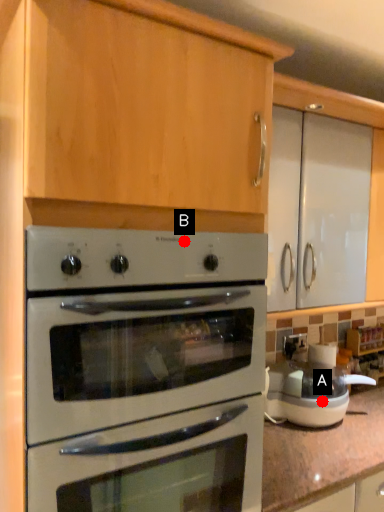
Question: Two points are circled on the image, labeled by A and B beside each circle. Which of the following is the closest to the observer?

Choices:
 (A) A is closer
 (B) B is closer

Answer: (B)